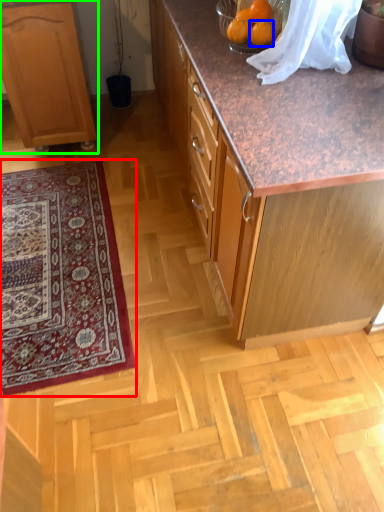
Question: Based on their relative distances, which object is farther from mat (highlighted by a red box)? Choose from orange (highlighted by a blue box) and cabinetry (highlighted by a green box).

Choices:
 (A) orange
 (B) cabinetry

Answer: (A)